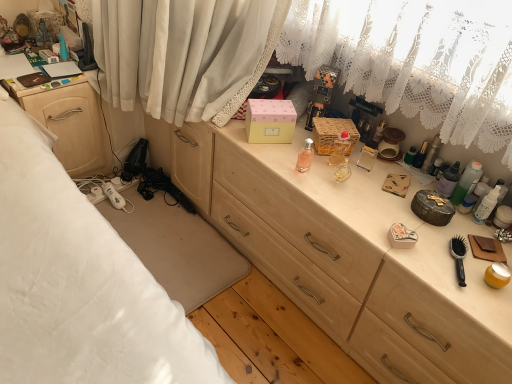
Identify the location of free space behind pink glass perfume at center, the first toiletry in the left-to-right sequence. This screenshot has width=512, height=384. (292, 135).